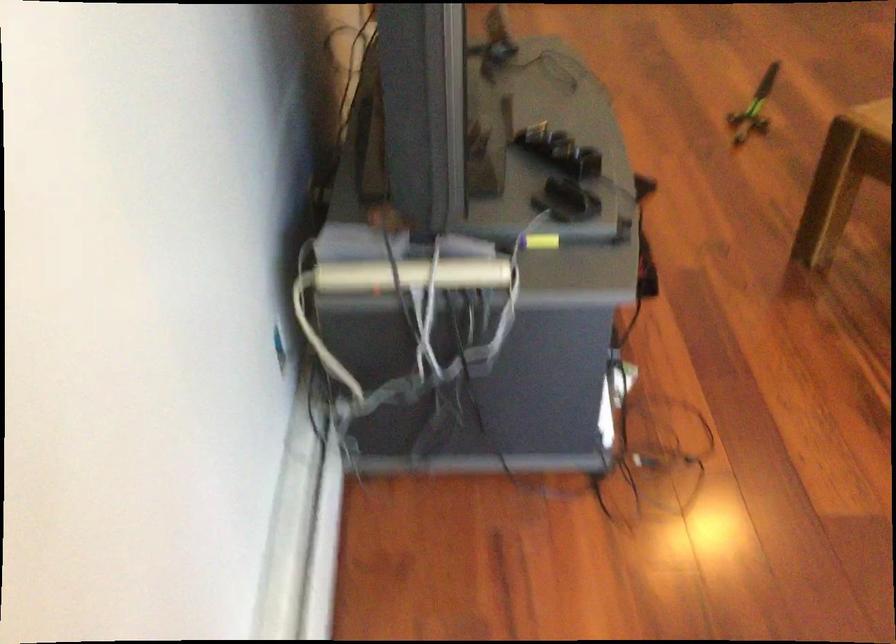
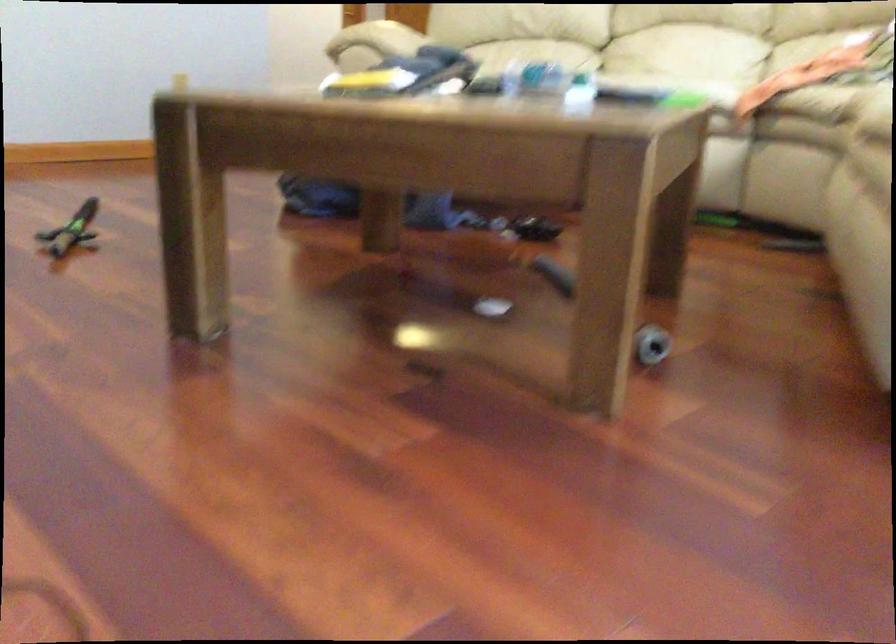
Find the pixel in the second image that matches [730,118] in the first image.

(71, 230)